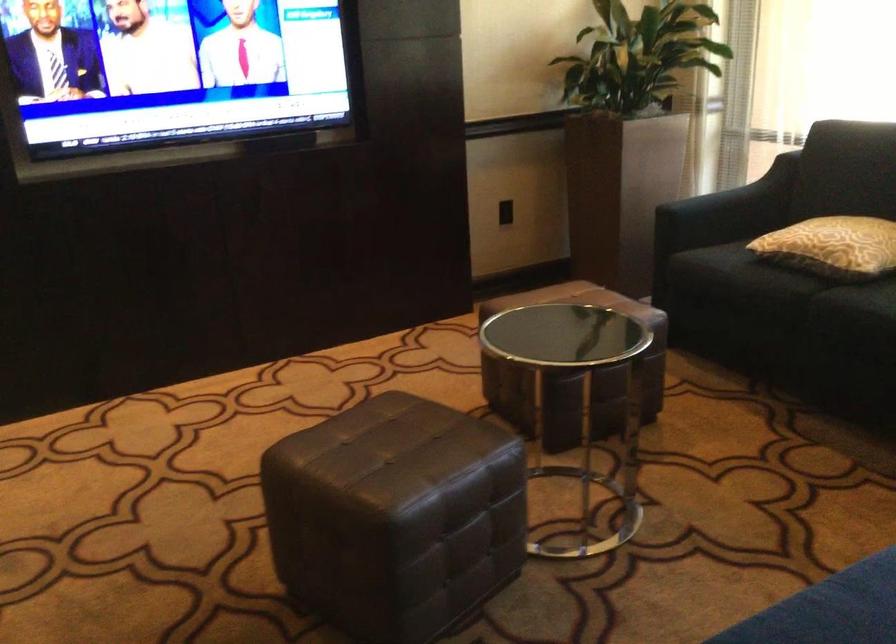
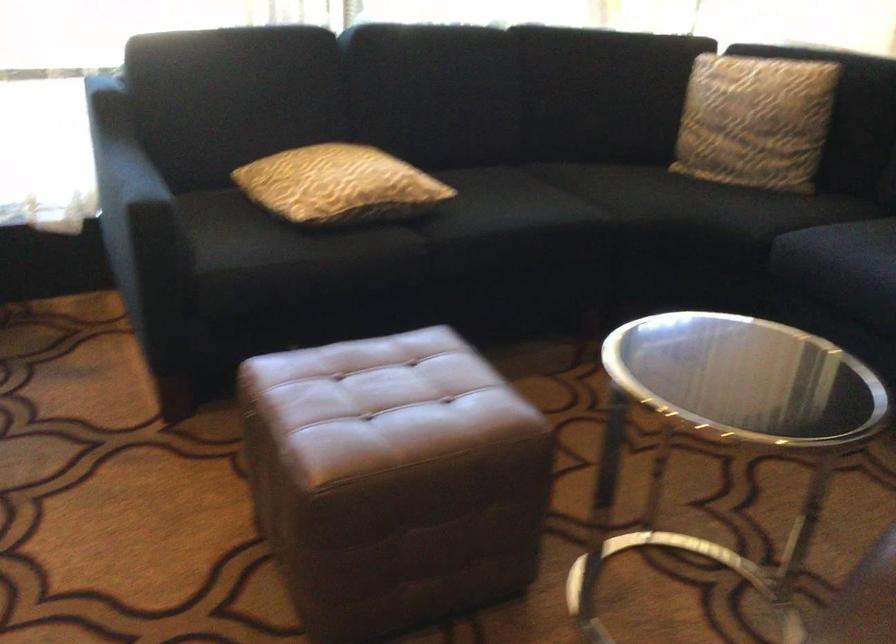
In the second image, find the point that corresponds to (800,231) in the first image.

(339, 185)